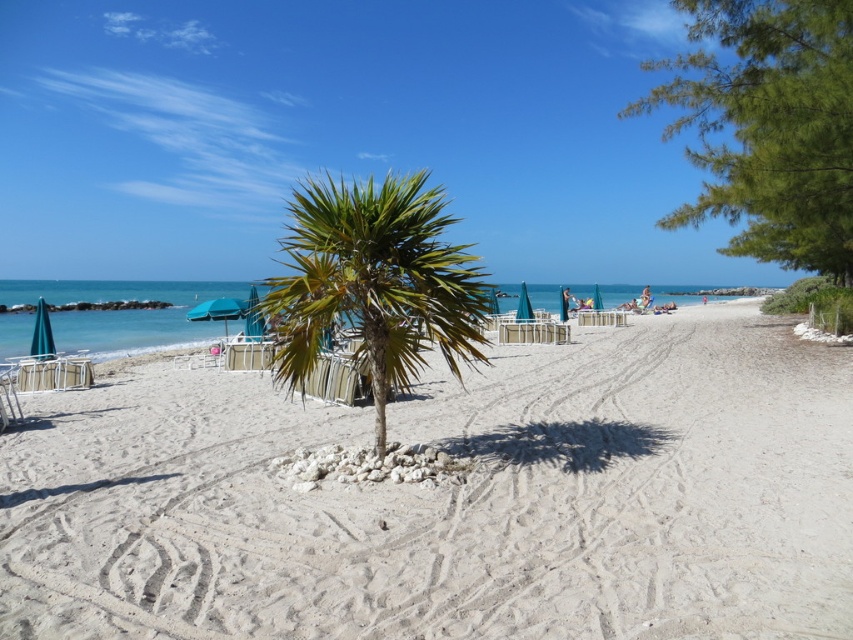
You are standing at the point marked by the coordinates point (374, 282) in the beach scene. What object are you directly at?

The point (374, 282) marks the green leafy palm tree at center.

You are standing at the edge of the white sandy beach at center and want to reach the blue fabric umbrella at center. Which direction should you move to get there?

The blue fabric umbrella at center is on the left side of the white sandy beach at center, so you should move to the left to reach it.